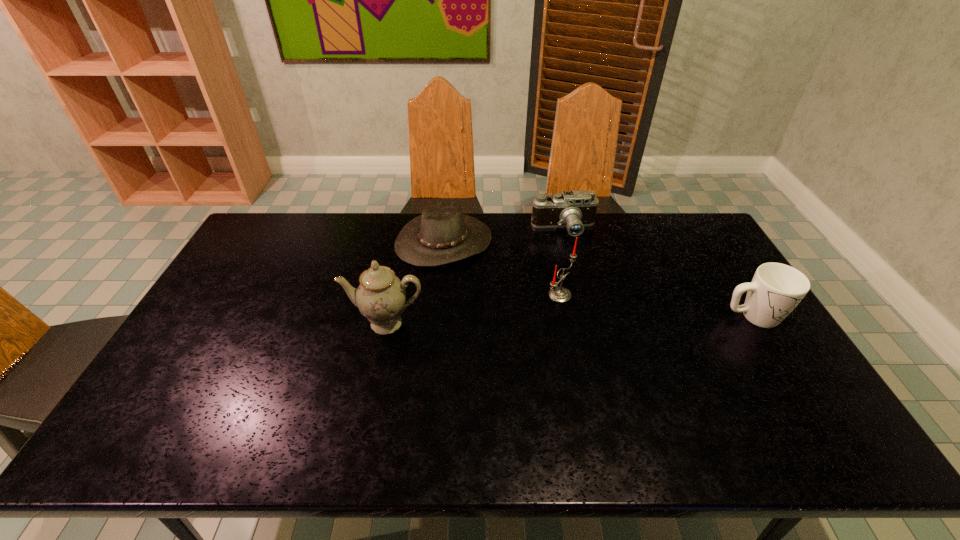
At what (x,y) coordinates should I click in order to perform the action: click on vacant point located between the camera and the tallest object. Please return your answer as a coordinate pair (x, y). The width and height of the screenshot is (960, 540). Looking at the image, I should click on (475, 276).

This screenshot has height=540, width=960. Find the location of `free spot between the camera and the mug`. free spot between the camera and the mug is located at coordinates (659, 273).

I want to click on vacant area that lies between the hat and the mug, so click(598, 279).

Identify the location of object identified as the fourth closest to the candle. (776, 289).

Image resolution: width=960 pixels, height=540 pixels. I want to click on object that ranks as the third closest to the hat, so click(x=381, y=296).

At what (x,y) coordinates should I click in order to perform the action: click on vacant area in the image that satisfies the following two spatial constraints: 1. on the front side of the mug; 2. on the side of the candle with the handle. Please return your answer as a coordinate pair (x, y). The width and height of the screenshot is (960, 540). Looking at the image, I should click on (564, 316).

The height and width of the screenshot is (540, 960). Identify the location of free location that satisfies the following two spatial constraints: 1. on the front side of the candle; 2. on the side of the rightmost object with the handle. (564, 316).

At what (x,y) coordinates should I click in order to perform the action: click on vacant area in the image that satisfies the following two spatial constraints: 1. on the front side of the camera; 2. on the side of the mug with the handle. Please return your answer as a coordinate pair (x, y). This screenshot has width=960, height=540. Looking at the image, I should click on (585, 316).